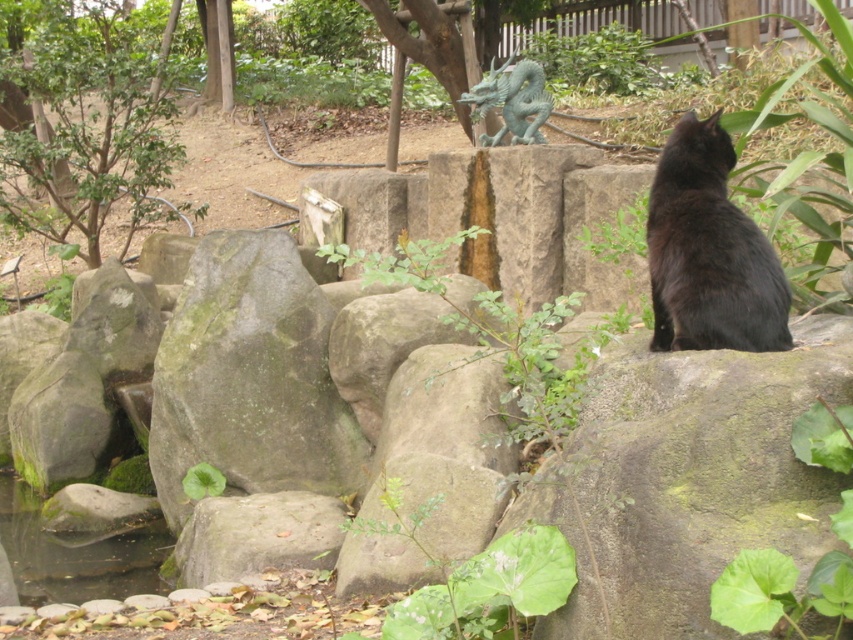
Question: Does green leafy tree at upper left appear on the left side of green patina dragon at center?

Choices:
 (A) yes
 (B) no

Answer: (A)

Question: Which of the following is the closest to the observer?

Choices:
 (A) green patina dragon at center
 (B) green leafy tree at upper left

Answer: (A)

Question: Can you confirm if green leafy tree at upper left is positioned to the right of green patina dragon at center?

Choices:
 (A) yes
 (B) no

Answer: (B)

Question: Considering the real-world distances, which object is farthest from the green patina dragon at center?

Choices:
 (A) green leafy tree at upper left
 (B) black fur cat at right

Answer: (A)

Question: Can you confirm if black fur cat at right is positioned above green patina dragon at center?

Choices:
 (A) yes
 (B) no

Answer: (B)

Question: Which of these objects is positioned farthest from the black fur cat at right?

Choices:
 (A) green patina dragon at center
 (B) green leafy tree at upper left

Answer: (B)